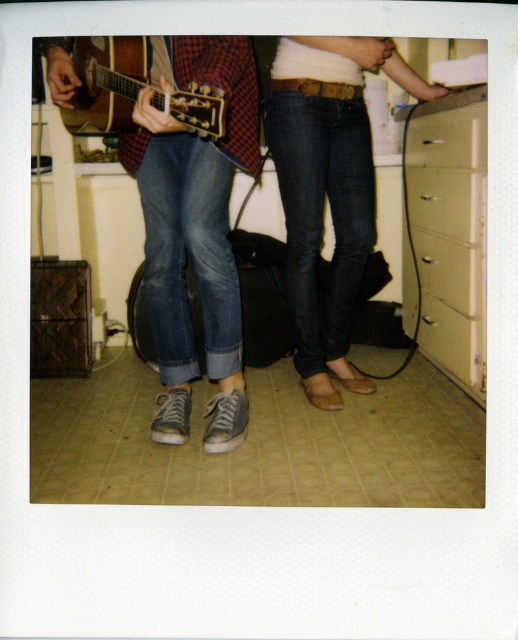
You are organizing a small indoor concert and need to place the dark blue jeans at center and the matte white drawer at right in a way that follows the spatial arrangement shown in the photo. Which object should be placed lower to maintain the correct positioning?

The dark blue jeans at center should be placed lower than the matte white drawer at right because the dark blue jeans at center is positioned under matte white drawer at right in the original image.

You are organizing a small music event in the room shown. You need to place a 1.2 meter long amplifier between the beige plastic file cabinet at right and the matte white drawer at right. Can the space between them accommodate the amplifier?

The beige plastic file cabinet at right is wider than the matte white drawer at right, but the exact distance between them isn

You are looking at the Polaroid photo described. There are two points marked in the image. The first point is at coordinates point [444,253] and the second is at point [444,234]. Which of these two points is closer to you, the viewer?

Point [444,253] is closer to the viewer because it is further to the camera than point [444,234].